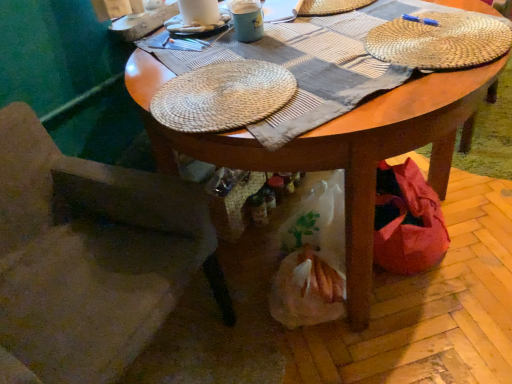
Question: In terms of size, does suede-like beige chair at lower left appear bigger or smaller than woven straw placemat at center, which is the first hat in bottom-to-top order?

Choices:
 (A) small
 (B) big

Answer: (B)

Question: Is point (105, 269) positioned closer to the camera than point (229, 87)?

Choices:
 (A) farther
 (B) closer

Answer: (B)

Question: Which of these objects is positioned closest to the wooden table at center?

Choices:
 (A) suede-like beige chair at lower left
 (B) woven straw placemat at center, which is the first hat in bottom-to-top order
 (C) matte ceramic mug at upper center
 (D) woven straw placemat at upper right, which appears as the 2th hat when viewed from the top
 (E) white woven hat at upper center, the third hat from the bottom

Answer: (B)

Question: Estimate the real-world distances between objects in this image. Which object is closer to the suede-like beige chair at lower left?

Choices:
 (A) woven straw placemat at center, which is the 3th hat in top-to-bottom order
 (B) woven straw placemat at upper right, which appears as the 2th hat when ordered from the bottom
 (C) wooden table at center
 (D) white woven hat at upper center, the 1th hat from the top
 (E) matte ceramic mug at upper center

Answer: (A)